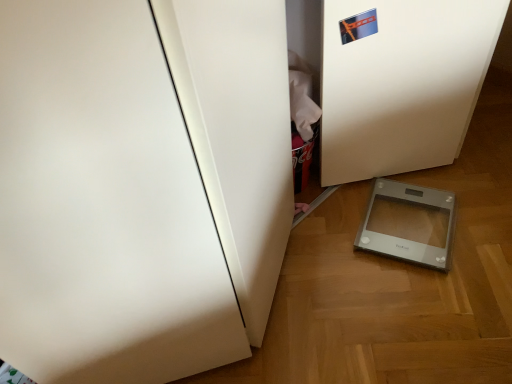
Question: Should I look upward or downward to see transparent plastic scale at lower right?

Choices:
 (A) up
 (B) down

Answer: (B)